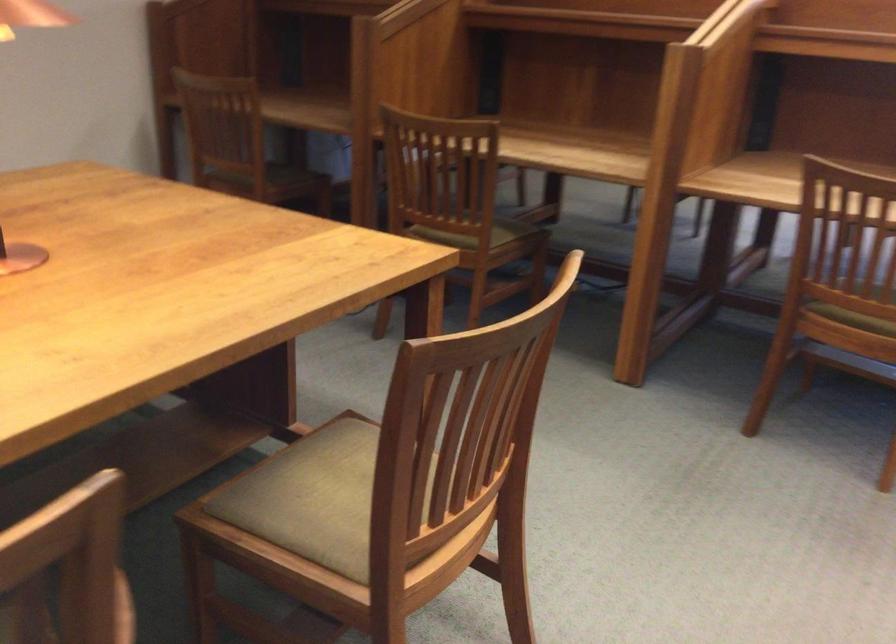
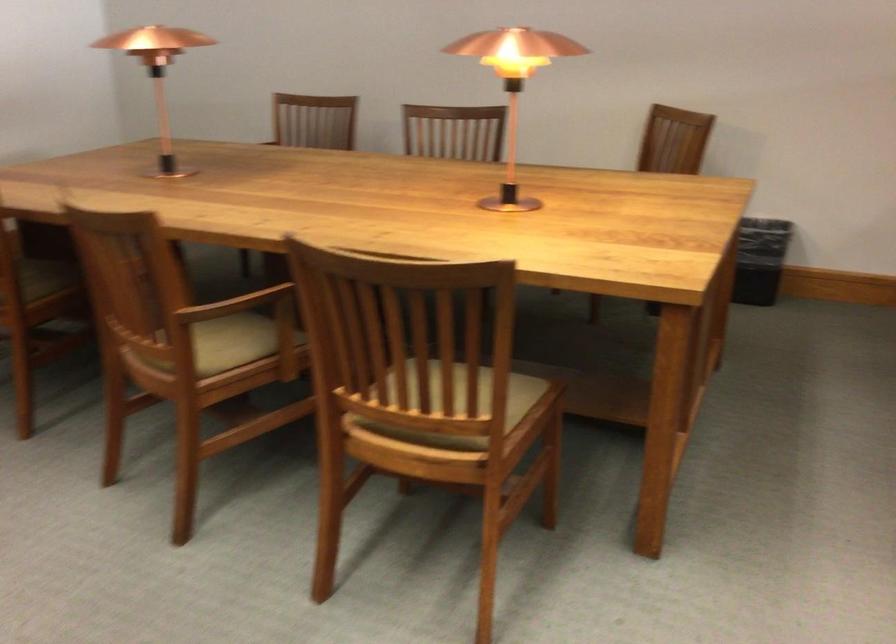
Where in the second image is the point corresponding to (x=500, y=453) from the first image?

(460, 404)